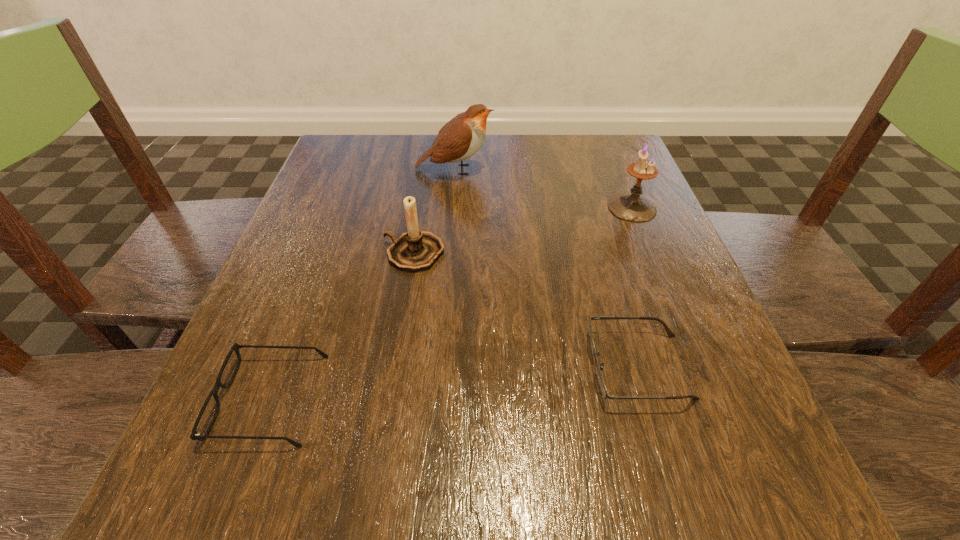
At what (x,y) coordinates should I click in order to perform the action: click on vacant space situated on the front-facing side of the right spectacles. Please return your answer as a coordinate pair (x, y). Looking at the image, I should click on (454, 367).

I want to click on vacant area located 0.180m on the front-facing side of the right spectacles, so click(468, 367).

This screenshot has height=540, width=960. Identify the location of free space located on the front-facing side of the right spectacles. (420, 367).

Image resolution: width=960 pixels, height=540 pixels. I want to click on object situated at the far edge, so click(x=460, y=138).

The width and height of the screenshot is (960, 540). Find the location of `object at the near edge`. object at the near edge is located at coordinates (194, 435).

You are a GUI agent. You are given a task and a screenshot of the screen. Output one action in this format:
    pyautogui.click(x=<x>, y=<y>)
    Task: Click on the object that is at the left edge
    
    Given the screenshot: What is the action you would take?
    pyautogui.click(x=194, y=435)

In order to click on candle holder that is at the right edge in this screenshot , I will do `click(632, 207)`.

In order to click on spectacles present at the right edge in this screenshot , I will do `click(602, 386)`.

This screenshot has height=540, width=960. In order to click on object positioned at the near left corner in this screenshot , I will do `click(194, 435)`.

Find the location of a particular element. This screenshot has height=540, width=960. vacant space at the far edge is located at coordinates 428,159.